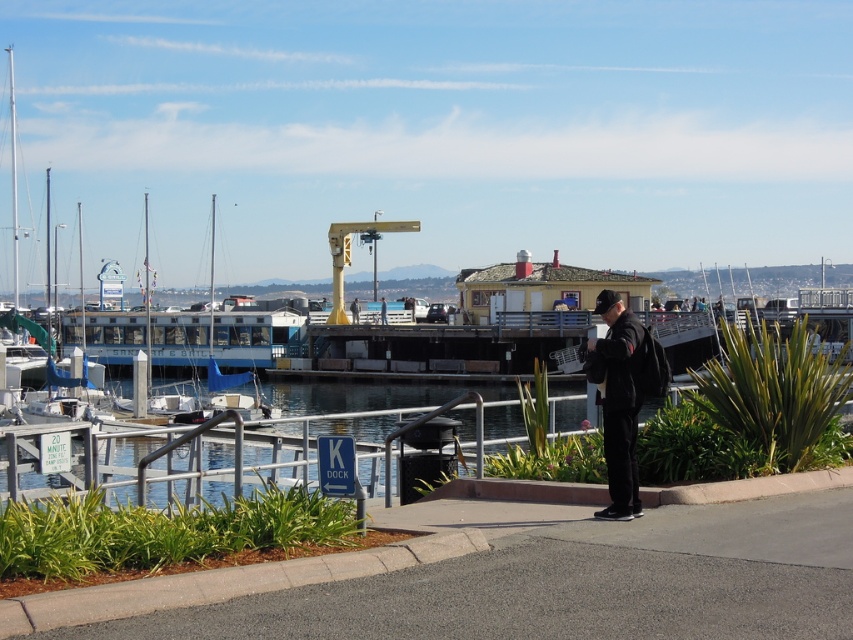
Who is lower down, clear water at dock left or blue painted wooden dock at center?

Positioned lower is clear water at dock left.

Does clear water at dock left have a greater width compared to blue painted wooden dock at center?

In fact, clear water at dock left might be narrower than blue painted wooden dock at center.

Between point (662, 408) and point (181, 360), which one is positioned behind?

Point (181, 360)

Locate an element on the screen. clear water at dock left is located at coordinates (497, 472).

Is the position of clear water at dock left more distant than that of black matte jacket at center?

No, it is in front of black matte jacket at center.

From the picture: Which is above, clear water at dock left or black matte jacket at center?

black matte jacket at center is above.

Is point (514, 445) positioned after point (608, 460)?

Yes, it is behind point (608, 460).

Where is `clear water at dock left`? This screenshot has height=640, width=853. clear water at dock left is located at coordinates (497, 472).

Does blue painted wooden dock at center have a smaller size compared to black matte jacket at center?

Actually, blue painted wooden dock at center might be larger than black matte jacket at center.

Does point (229, 328) come farther from viewer compared to point (613, 436)?

That is True.

Identify the location of blue painted wooden dock at center. This screenshot has height=640, width=853. pyautogui.click(x=186, y=333).